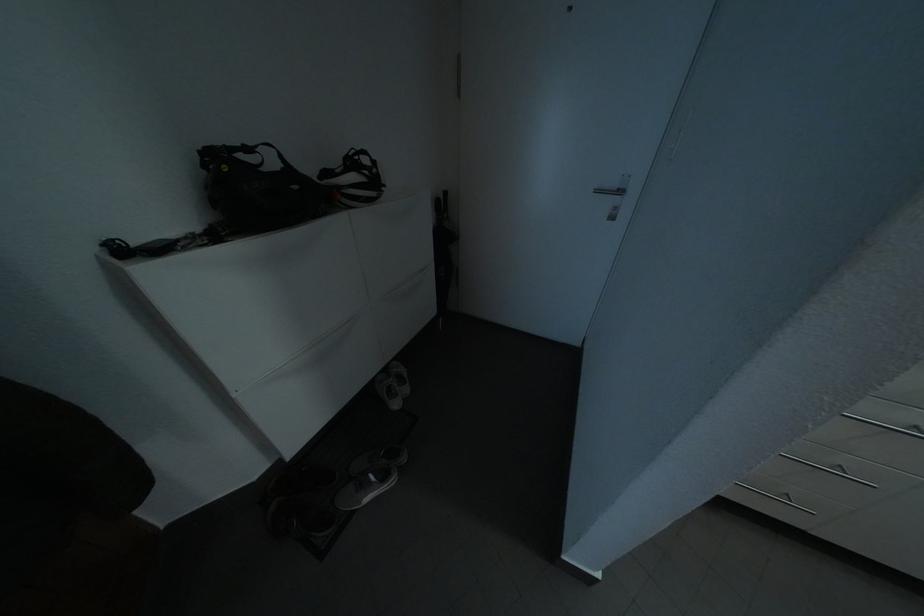
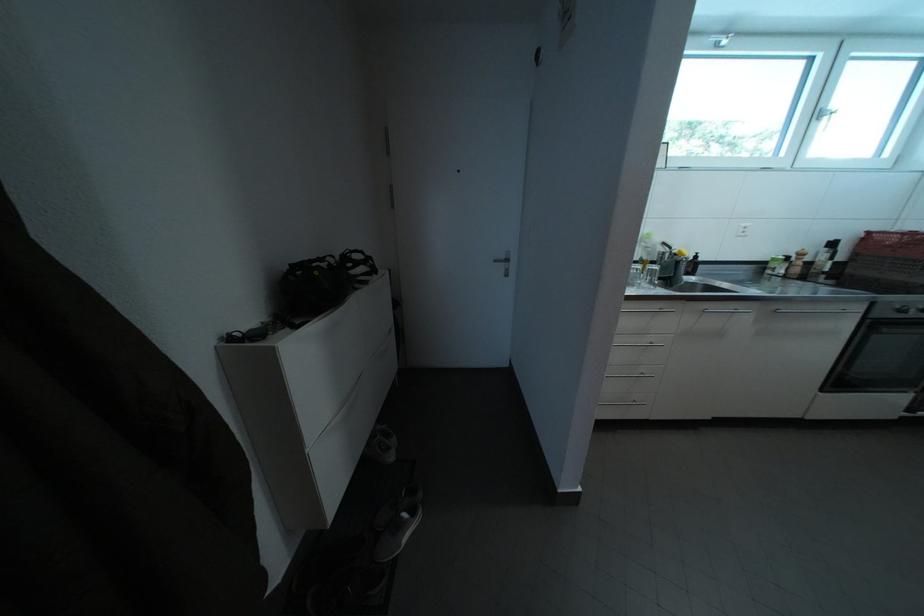
Question: The images are taken continuously from a first-person perspective. In which direction is your viewpoint rotating?

Choices:
 (A) Left
 (B) Right
 (C) Up
 (D) Down

Answer: (B)